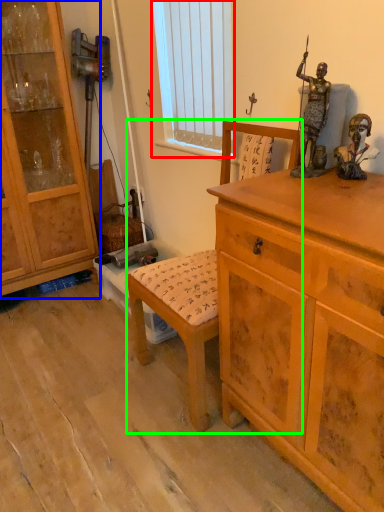
Question: Estimate the real-world distances between objects in this image. Which object is closer to window screen (highlighted by a red box), cabinetry (highlighted by a blue box) or rocking chair (highlighted by a green box)?

Choices:
 (A) cabinetry
 (B) rocking chair

Answer: (A)